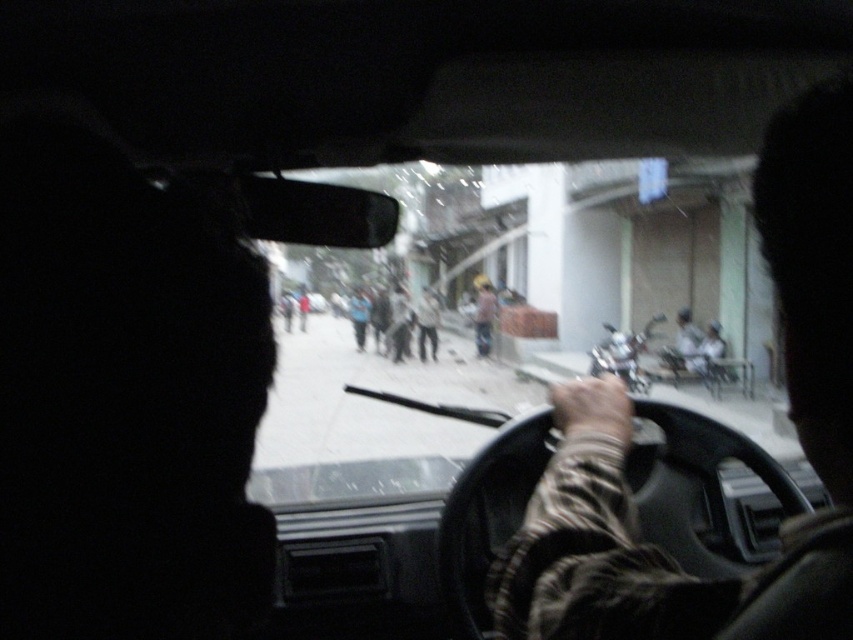
Who is more distant from viewer, (479, 291) or (354, 300)?

Point (354, 300)

Which is in front, point (495, 312) or point (368, 312)?

Point (495, 312) is more forward.

At what (x,y) coordinates should I click in order to perform the action: click on yellow helmet at center. Please return your answer as a coordinate pair (x, y). Looking at the image, I should click on (485, 316).

Is yellow helmet at center below smooth gray helmet at center?

Actually, yellow helmet at center is above smooth gray helmet at center.

Is yellow helmet at center closer to the viewer compared to smooth gray helmet at center?

No.

Describe the element at coordinates (485, 316) in the screenshot. I see `yellow helmet at center` at that location.

What are the coordinates of `yellow helmet at center` in the screenshot? It's located at (485, 316).

Can you confirm if transparent glass windshield at center is shorter than shiny chrome motorcycle at center?

No, transparent glass windshield at center is not shorter than shiny chrome motorcycle at center.

Who is more forward, (619, 278) or (645, 385)?

Point (645, 385)

Is point (431, 195) closer to camera compared to point (618, 342)?

No, (431, 195) is further to viewer.

The width and height of the screenshot is (853, 640). I want to click on transparent glass windshield at center, so click(x=473, y=317).